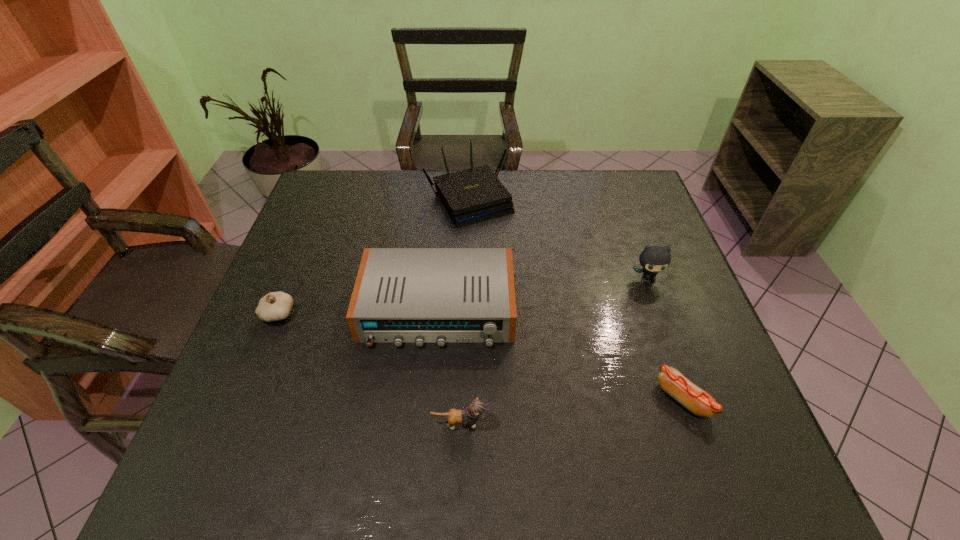
The height and width of the screenshot is (540, 960). In order to click on router in this screenshot , I will do `click(471, 196)`.

Where is `the farther kitten`? the farther kitten is located at coordinates (654, 259).

At what (x,y) coordinates should I click in order to perform the action: click on the right kitten. Please return your answer as a coordinate pair (x, y). The image size is (960, 540). Looking at the image, I should click on (654, 259).

At what (x,y) coordinates should I click in order to perform the action: click on radio receiver. Please return your answer as a coordinate pair (x, y). This screenshot has height=540, width=960. Looking at the image, I should click on (419, 295).

Image resolution: width=960 pixels, height=540 pixels. Find the location of `the nearer kitten`. the nearer kitten is located at coordinates (477, 409).

Find the location of `the shorter kitten`. the shorter kitten is located at coordinates (477, 409).

I want to click on the leftmost object, so click(275, 306).

Find the location of a particular element. The width and height of the screenshot is (960, 540). sausage is located at coordinates (699, 402).

Locate an element on the screen. Image resolution: width=960 pixels, height=540 pixels. vacant space situated on the right of the farthest object is located at coordinates (549, 199).

Find the location of a particular element. Image resolution: width=960 pixels, height=540 pixels. vacant area situated on the front-facing side of the farther kitten is located at coordinates (669, 339).